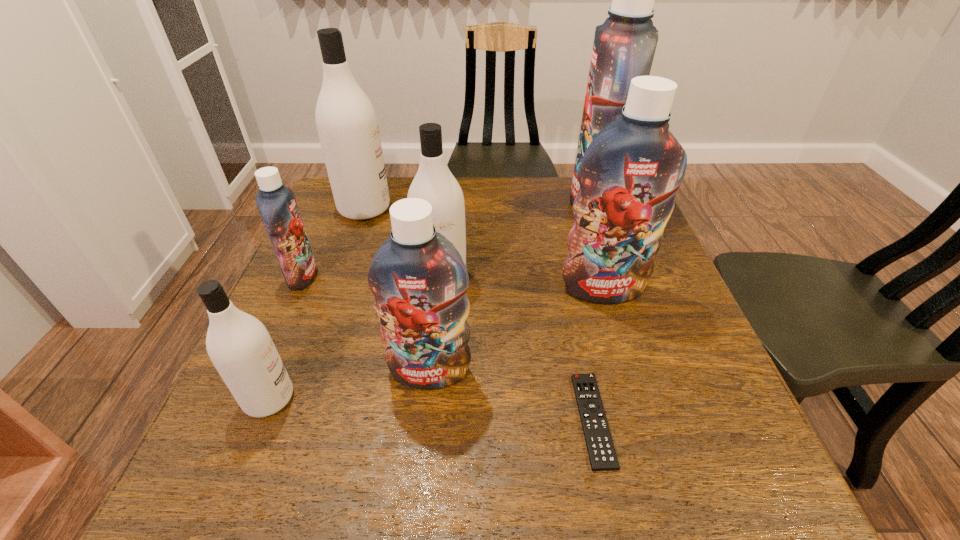
Identify the location of free space located on the back of the remote control. (559, 256).

Identify the location of object at the near edge. (601, 451).

Where is `object located in the far left corner section of the desktop`? Image resolution: width=960 pixels, height=540 pixels. object located in the far left corner section of the desktop is located at coordinates (346, 121).

I want to click on object present at the far right corner, so click(624, 45).

In the image, there is a desktop. In order to click on vacant space at the far edge in this screenshot , I will do `click(512, 176)`.

This screenshot has height=540, width=960. What are the coordinates of `free point at the near edge` in the screenshot? It's located at (551, 501).

This screenshot has width=960, height=540. Identify the location of vacant space at the left edge of the desktop. (285, 293).

You are a GUI agent. You are given a task and a screenshot of the screen. Output one action in this format:
    pyautogui.click(x=<x>, y=<y>)
    Task: Click on the blank region between the second biggest white shampoo and the tallest object
    Image resolution: width=960 pixels, height=540 pixels.
    Given the screenshot: What is the action you would take?
    pos(517,241)

This screenshot has width=960, height=540. What are the coordinates of `vacant area that lies between the tallest shampoo and the remote control` in the screenshot? It's located at (593, 312).

Image resolution: width=960 pixels, height=540 pixels. In order to click on vacant space in between the leftmost blue shampoo and the smallest white shampoo in this screenshot , I will do `click(286, 338)`.